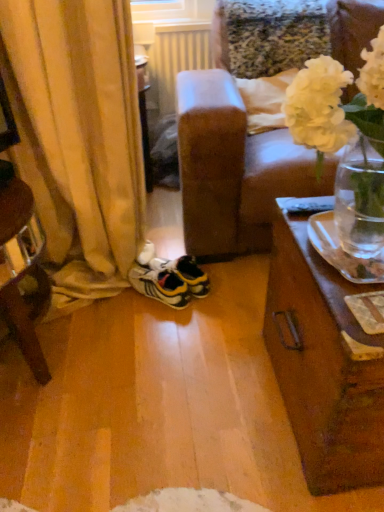
The width and height of the screenshot is (384, 512). Describe the element at coordinates (175, 62) in the screenshot. I see `white plastic radiator at upper center` at that location.

Locate an element on the screen. This screenshot has width=384, height=512. yellow fabric curtain at left is located at coordinates (78, 138).

Is yellow and white synthetic sneakers at center aimed at white plastic radiator at upper center?

No.

Considering the sizes of objects yellow and white synthetic sneakers at center and white plastic radiator at upper center in the image provided, who is thinner, yellow and white synthetic sneakers at center or white plastic radiator at upper center?

With smaller width is white plastic radiator at upper center.

From the image's perspective, is yellow and white synthetic sneakers at center under white plastic radiator at upper center?

Yes, from the image's perspective, yellow and white synthetic sneakers at center is below white plastic radiator at upper center.

Is point (195, 265) positioned behind point (167, 48)?

No, (195, 265) is in front of (167, 48).

Does white matte vase at upper right have a lesser height compared to yellow and white synthetic sneakers at center?

No.

Is white matte vase at upper right bigger or smaller than yellow and white synthetic sneakers at center?

Considering their sizes, white matte vase at upper right takes up more space than yellow and white synthetic sneakers at center.

Image resolution: width=384 pixels, height=512 pixels. I want to click on curtain above the white matte vase at upper right (from the image's perspective), so 78,138.

From the image's perspective, which one is positioned higher, white matte vase at upper right or yellow fabric curtain at left?

yellow fabric curtain at left appears higher in the image.

Is white matte vase at upper right not close to yellow fabric curtain at left?

No.

Which object is further away from the camera, white matte vase at upper right or yellow fabric curtain at left?

yellow fabric curtain at left.

In the image, is yellow and white synthetic sneakers at center on the left side or the right side of yellow fabric curtain at left?

yellow and white synthetic sneakers at center is to the right of yellow fabric curtain at left.

Looking at the image, does yellow and white synthetic sneakers at center seem bigger or smaller compared to yellow fabric curtain at left?

Considering their sizes, yellow and white synthetic sneakers at center takes up less space than yellow fabric curtain at left.

How many degrees apart are the facing directions of yellow and white synthetic sneakers at center and yellow fabric curtain at left?

yellow and white synthetic sneakers at center and yellow fabric curtain at left are facing 42.8 degrees away from each other.

Which is closer to the camera, (174,277) or (140,246)?

Positioned in front is point (174,277).

Considering the sizes of objects white plastic radiator at upper center and yellow and white synthetic sneakers at center in the image provided, who is wider, white plastic radiator at upper center or yellow and white synthetic sneakers at center?

yellow and white synthetic sneakers at center is wider.

Is white plastic radiator at upper center facing away from yellow and white synthetic sneakers at center?

No, white plastic radiator at upper center's orientation is not away from yellow and white synthetic sneakers at center.

Can you confirm if white plastic radiator at upper center is taller than yellow and white synthetic sneakers at center?

Yes, white plastic radiator at upper center is taller than yellow and white synthetic sneakers at center.

From the image's perspective, is white plastic radiator at upper center above or below yellow and white synthetic sneakers at center?

white plastic radiator at upper center is above yellow and white synthetic sneakers at center.

Considering the sizes of objects white matte vase at upper right and white plastic radiator at upper center in the image provided, who is shorter, white matte vase at upper right or white plastic radiator at upper center?

Standing shorter between the two is white plastic radiator at upper center.

Can we say white matte vase at upper right lies outside white plastic radiator at upper center?

Yes, white matte vase at upper right is located beyond the bounds of white plastic radiator at upper center.

From the image's perspective, between white matte vase at upper right and white plastic radiator at upper center, who is located below?

white matte vase at upper right, from the image's perspective.

Is white matte vase at upper right further to camera compared to white plastic radiator at upper center?

No, the depth of white matte vase at upper right is less than that of white plastic radiator at upper center.

Considering the sizes of objects yellow fabric curtain at left and yellow and white synthetic sneakers at center in the image provided, who is taller, yellow fabric curtain at left or yellow and white synthetic sneakers at center?

yellow fabric curtain at left.

Based on the photo, how distant is yellow fabric curtain at left from yellow and white synthetic sneakers at center?

They are 14.59 inches apart.

The image size is (384, 512). What are the coordinates of `footwear located underneath the yellow fabric curtain at left (from a real-world perspective)` in the screenshot? It's located at (168, 278).

Is yellow fabric curtain at left facing towards yellow and white synthetic sneakers at center?

No, yellow fabric curtain at left is not turned towards yellow and white synthetic sneakers at center.

I want to click on radiator that is behind the yellow and white synthetic sneakers at center, so click(x=175, y=62).

The width and height of the screenshot is (384, 512). In order to click on floral arrangement on the right of yellow and white synthetic sneakers at center in this screenshot , I will do pyautogui.click(x=346, y=140).

Considering their positions, is yellow fabric curtain at left positioned closer to yellow and white synthetic sneakers at center than white matte vase at upper right?

The object closer to yellow and white synthetic sneakers at center is yellow fabric curtain at left.

Which object lies nearer to the anchor point yellow fabric curtain at left, yellow and white synthetic sneakers at center or white plastic radiator at upper center?

Among the two, yellow and white synthetic sneakers at center is located nearer to yellow fabric curtain at left.

Based on their spatial positions, is white matte vase at upper right or yellow and white synthetic sneakers at center closer to yellow fabric curtain at left?

Based on the image, yellow and white synthetic sneakers at center appears to be nearer to yellow fabric curtain at left.

From the image, which object appears to be farther from yellow fabric curtain at left, white plastic radiator at upper center or yellow and white synthetic sneakers at center?

white plastic radiator at upper center is positioned further to the anchor yellow fabric curtain at left.

Looking at the image, which one is located further to yellow and white synthetic sneakers at center, white plastic radiator at upper center or white matte vase at upper right?

white plastic radiator at upper center lies further to yellow and white synthetic sneakers at center than the other object.

Based on their spatial positions, is yellow fabric curtain at left or yellow and white synthetic sneakers at center closer to white plastic radiator at upper center?

yellow fabric curtain at left.

Looking at the image, which one is located closer to white matte vase at upper right, white plastic radiator at upper center or yellow and white synthetic sneakers at center?

yellow and white synthetic sneakers at center lies closer to white matte vase at upper right than the other object.

Looking at the image, which one is located further to white plastic radiator at upper center, yellow and white synthetic sneakers at center or white matte vase at upper right?

Among the two, white matte vase at upper right is located further to white plastic radiator at upper center.

Find the location of a particular element. The width and height of the screenshot is (384, 512). curtain positioned between white matte vase at upper right and white plastic radiator at upper center from near to far is located at coordinates (78, 138).

Where is `curtain located between white matte vase at upper right and yellow and white synthetic sneakers at center in the depth direction`? curtain located between white matte vase at upper right and yellow and white synthetic sneakers at center in the depth direction is located at coordinates (78, 138).

Identify the location of footwear located between yellow fabric curtain at left and white plastic radiator at upper center in the depth direction. (168, 278).

Where is `footwear between white matte vase at upper right and white plastic radiator at upper center along the z-axis`? The height and width of the screenshot is (512, 384). footwear between white matte vase at upper right and white plastic radiator at upper center along the z-axis is located at coordinates (168, 278).